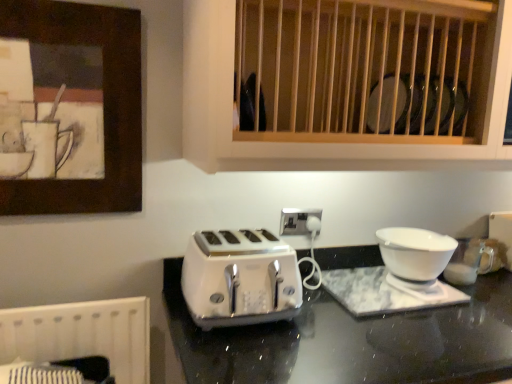
Question: From a real-world perspective, is wooden picture frame at upper left over white glossy bowl at right?

Choices:
 (A) yes
 (B) no

Answer: (A)

Question: Is wooden picture frame at upper left to the left of white glossy bowl at right from the viewer's perspective?

Choices:
 (A) yes
 (B) no

Answer: (A)

Question: Is wooden picture frame at upper left not inside white glossy bowl at right?

Choices:
 (A) no
 (B) yes

Answer: (B)

Question: Is wooden picture frame at upper left shorter than white glossy bowl at right?

Choices:
 (A) yes
 (B) no

Answer: (B)

Question: Is wooden picture frame at upper left turned away from white glossy bowl at right?

Choices:
 (A) no
 (B) yes

Answer: (A)

Question: Is white glossy bowl at right inside wooden picture frame at upper left?

Choices:
 (A) yes
 (B) no

Answer: (B)

Question: From the image's perspective, would you say white glossy bowl at right is positioned over wooden slats at upper center?

Choices:
 (A) yes
 (B) no

Answer: (B)

Question: Considering the relative sizes of white glossy bowl at right and wooden slats at upper center in the image provided, is white glossy bowl at right bigger than wooden slats at upper center?

Choices:
 (A) no
 (B) yes

Answer: (A)

Question: From a real-world perspective, does white glossy bowl at right sit lower than wooden slats at upper center?

Choices:
 (A) no
 (B) yes

Answer: (B)

Question: From the image's perspective, is white glossy bowl at right below wooden slats at upper center?

Choices:
 (A) no
 (B) yes

Answer: (B)

Question: Is white glossy bowl at right aimed at wooden slats at upper center?

Choices:
 (A) no
 (B) yes

Answer: (A)

Question: Considering the relative sizes of white glossy bowl at right and wooden slats at upper center in the image provided, is white glossy bowl at right wider than wooden slats at upper center?

Choices:
 (A) no
 (B) yes

Answer: (A)

Question: Is wooden slats at upper center further to the viewer compared to white glossy toaster at center?

Choices:
 (A) no
 (B) yes

Answer: (A)